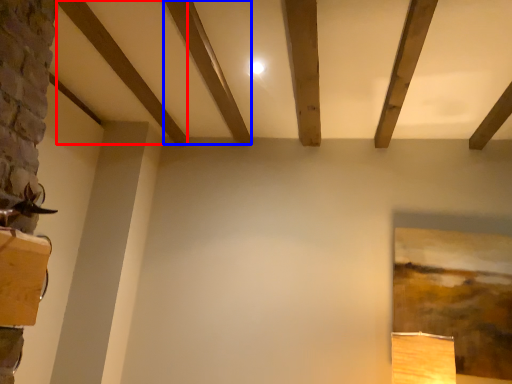
Question: Which object is further to the camera taking this photo, plank (highlighted by a red box) or plank (highlighted by a blue box)?

Choices:
 (A) plank
 (B) plank

Answer: (A)